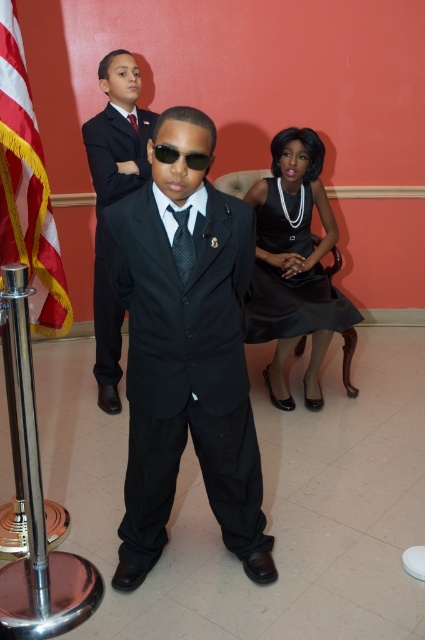
Based on the photo, what object is located at the coordinate point (27, 188) in the image?

The point (27, 188) indicates a red and white striped flag at the left.

You are a photographer at a formal event and need to adjust the lighting to ensure both the matte black suit at center and the black satin suit at center are visible. Which suit will require more light to appear properly lit in the photo?

The black satin suit at center will require more light to appear properly lit because it is positioned above the matte black suit at center, which may cast shadows or require different lighting adjustments.